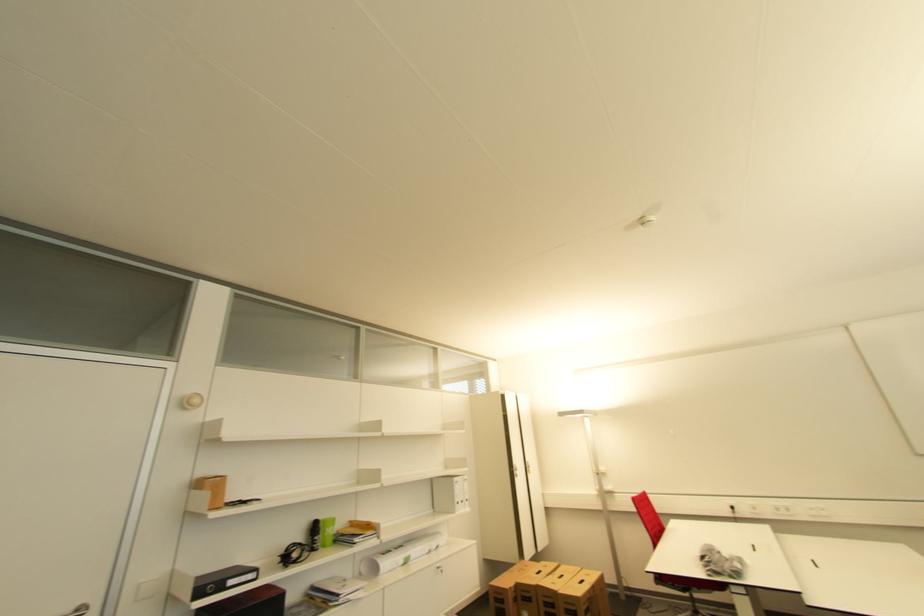
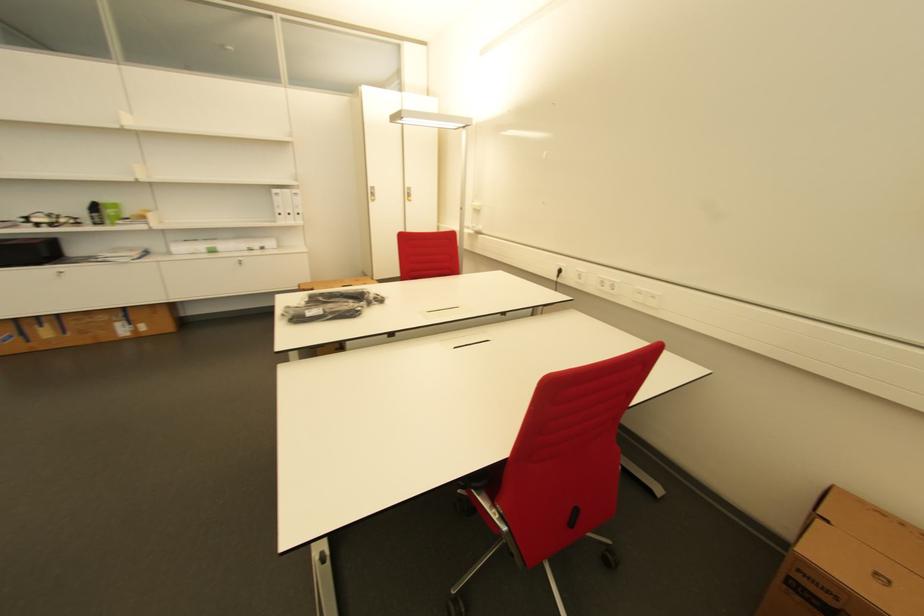
In the second image, find the point that corresponds to (x=326, y=527) in the first image.

(104, 208)